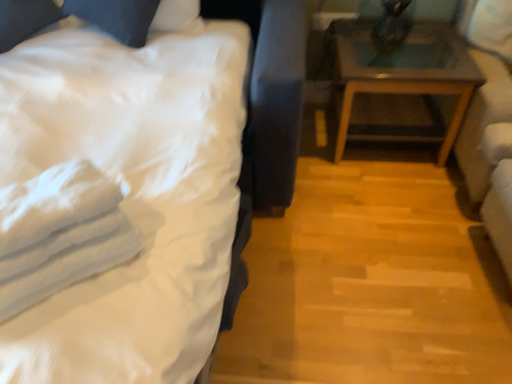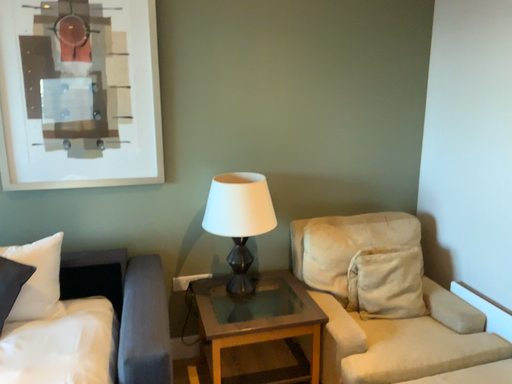
Question: How did the camera likely rotate when shooting the video?

Choices:
 (A) rotated left
 (B) rotated right

Answer: (B)